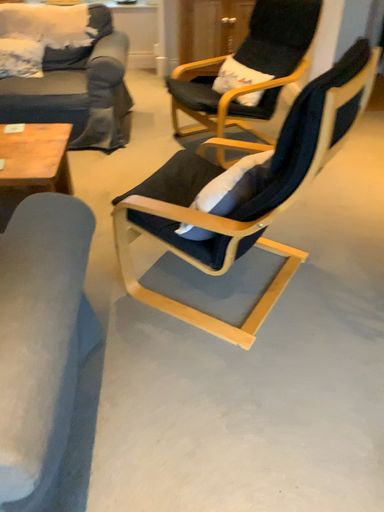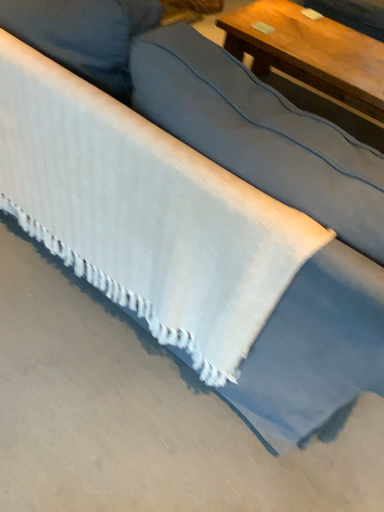
Question: Which way did the camera rotate in the video?

Choices:
 (A) rotated right
 (B) rotated left

Answer: (B)